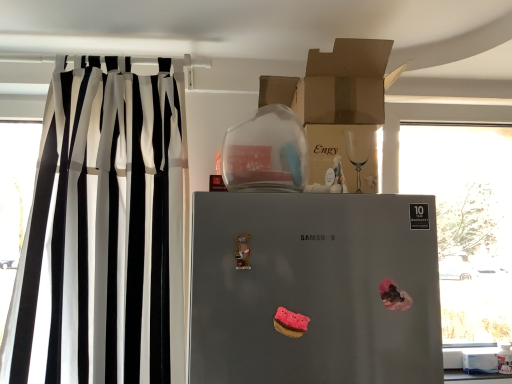
Question: Should I look upward or downward to see transparent glass window at right?

Choices:
 (A) down
 (B) up

Answer: (A)

Question: Does pink matte donut at center, which is counted as the 2th stuff, starting from the back, have a greater width compared to transparent glass window at right?

Choices:
 (A) no
 (B) yes

Answer: (A)

Question: From a real-world perspective, is pink matte donut at center, the first stuff from the left, positioned over transparent glass window at right based on gravity?

Choices:
 (A) yes
 (B) no

Answer: (B)

Question: From the image's perspective, is pink matte donut at center, marked as the first stuff in a bottom-to-top arrangement, located beneath transparent glass window at right?

Choices:
 (A) yes
 (B) no

Answer: (A)

Question: Is pink matte donut at center, which ranks as the second stuff in top-to-bottom order, located outside transparent glass window at right?

Choices:
 (A) yes
 (B) no

Answer: (A)

Question: Does pink matte donut at center, placed as the 2th stuff when sorted from right to left, touch transparent glass window at right?

Choices:
 (A) no
 (B) yes

Answer: (A)

Question: From a real-world perspective, is pink matte donut at center, placed as the 2th stuff when sorted from right to left, beneath transparent glass window at right?

Choices:
 (A) no
 (B) yes

Answer: (B)

Question: Considering the relative positions of matte brown cardboard box at upper center, arranged as the 1th cardboard box when ordered from the bottom, and pink matte donut at center, placed as the 2th stuff when sorted from right to left, in the image provided, is matte brown cardboard box at upper center, arranged as the 1th cardboard box when ordered from the bottom, to the right of pink matte donut at center, placed as the 2th stuff when sorted from right to left, from the viewer's perspective?

Choices:
 (A) yes
 (B) no

Answer: (A)

Question: Could you tell me if matte brown cardboard box at upper center, arranged as the 1th cardboard box when ordered from the bottom, is facing pink matte donut at center, positioned as the first stuff in front-to-back order?

Choices:
 (A) yes
 (B) no

Answer: (B)

Question: Is matte brown cardboard box at upper center, which is the 2th cardboard box in top-to-bottom order, at the left side of pink matte donut at center, positioned as the first stuff in front-to-back order?

Choices:
 (A) yes
 (B) no

Answer: (B)

Question: Can you confirm if matte brown cardboard box at upper center, which is the 2th cardboard box in top-to-bottom order, is wider than pink matte donut at center, marked as the first stuff in a bottom-to-top arrangement?

Choices:
 (A) no
 (B) yes

Answer: (B)

Question: From a real-world perspective, is matte brown cardboard box at upper center, which is the 2th cardboard box in top-to-bottom order, positioned over pink matte donut at center, placed as the 2th stuff when sorted from right to left, based on gravity?

Choices:
 (A) no
 (B) yes

Answer: (B)

Question: Is matte brown cardboard box at upper center, arranged as the 1th cardboard box when ordered from the bottom, bigger than pink matte donut at center, placed as the 2th stuff when sorted from right to left?

Choices:
 (A) yes
 (B) no

Answer: (A)

Question: Considering the relative sizes of satin silver refrigerator at center and transparent glass window at right in the image provided, is satin silver refrigerator at center taller than transparent glass window at right?

Choices:
 (A) no
 (B) yes

Answer: (A)